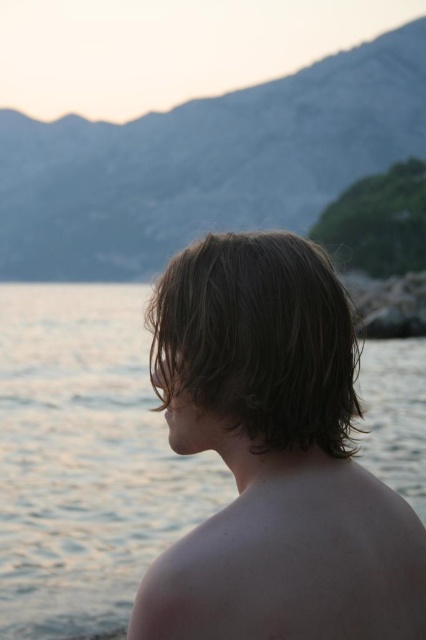
Measure the distance between pale skin at back and dark brown wavy hair at center.

pale skin at back is 27.55 inches from dark brown wavy hair at center.

Between pale skin at back and dark brown wavy hair at center, which one is positioned lower?

pale skin at back is lower down.

Describe the element at coordinates (293, 561) in the screenshot. Image resolution: width=426 pixels, height=640 pixels. I see `pale skin at back` at that location.

The image size is (426, 640). What are the coordinates of `pale skin at back` in the screenshot? It's located at (293, 561).

Can you confirm if brown matte hair at center is smaller than dark brown wavy hair at center?

No.

Can you confirm if brown matte hair at center is positioned below dark brown wavy hair at center?

Yes.

Who is more distant from viewer, (342, 298) or (207, 372)?

The point (342, 298) is behind.

Find the location of `brown matte hair at center`. brown matte hair at center is located at coordinates (273, 456).

This screenshot has width=426, height=640. What do you see at coordinates (273, 456) in the screenshot?
I see `brown matte hair at center` at bounding box center [273, 456].

Between brown matte hair at center and pale skin at back, which one is positioned lower?

pale skin at back

The height and width of the screenshot is (640, 426). Identify the location of brown matte hair at center. click(x=273, y=456).

Where is `brown matte hair at center`? This screenshot has width=426, height=640. brown matte hair at center is located at coordinates (273, 456).